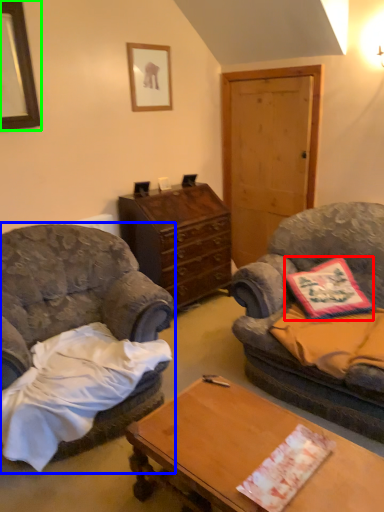
Question: Estimate the real-world distances between objects in this image. Which object is farther from pillow (highlighted by a red box), chair (highlighted by a blue box) or picture frame (highlighted by a green box)?

Choices:
 (A) chair
 (B) picture frame

Answer: (B)